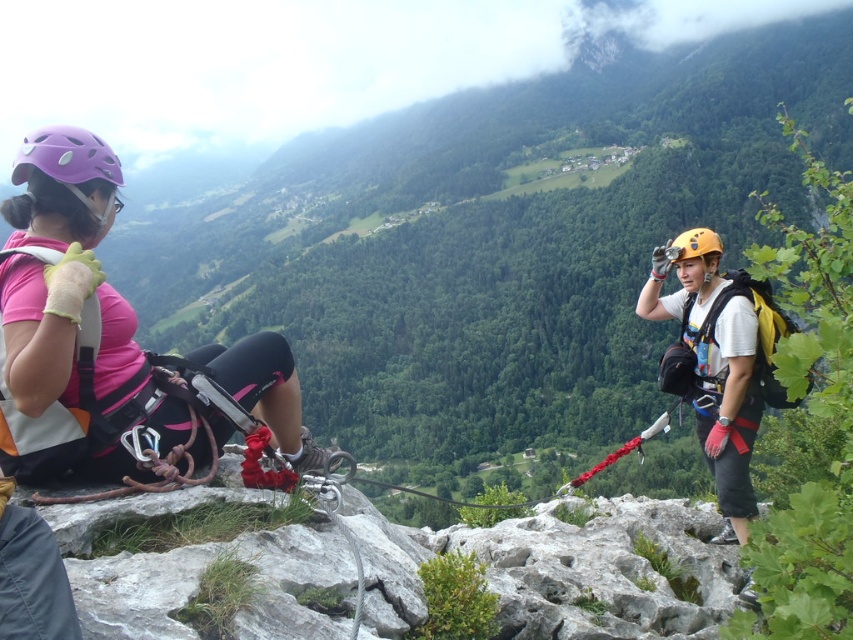
You are a safety inspector assessing the climbing gear in the image. Both the yellow matte helmet at right and the purple matte helmet at left are visible. Which helmet has a greater height?

The purple matte helmet at left is taller than the yellow matte helmet at right.

You are a safety inspector assessing the distance between the yellow matte helmet at right and the purple matte helmet at left on the rocky ledge. According to safety protocols, climbers must maintain a minimum distance of 20 meters to avoid collision risks. Is the current distance compliant with safety standards?

The yellow matte helmet at right and the purple matte helmet at left are 21.94 meters apart, which exceeds the minimum required distance of 20 meters. Therefore, the current distance complies with safety standards.